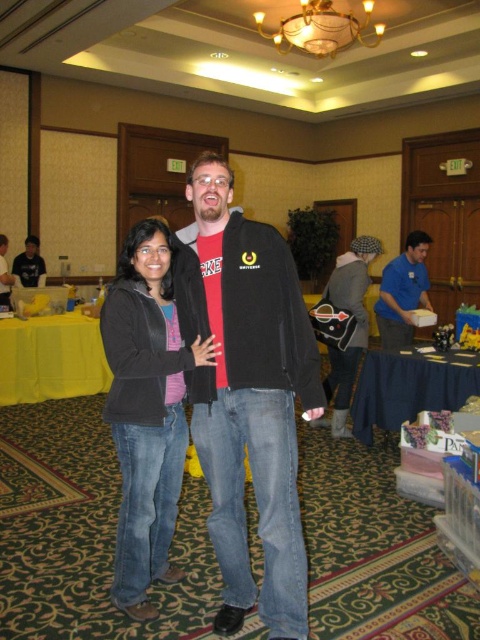
Does black soft jacket at center have a lesser width compared to blue shirt at center?

Indeed, black soft jacket at center has a lesser width compared to blue shirt at center.

Does black soft jacket at center appear on the right side of blue shirt at center?

Incorrect, black soft jacket at center is not on the right side of blue shirt at center.

Is point (136, 406) positioned behind point (385, 316)?

That is False.

Locate an element on the screen. black soft jacket at center is located at coordinates (146, 410).

Does black soft jacket at center have a smaller size compared to matte black jacket at left?

Actually, black soft jacket at center might be larger than matte black jacket at left.

Measure the distance between black soft jacket at center and matte black jacket at left.

black soft jacket at center is 18.88 feet away from matte black jacket at left.

The height and width of the screenshot is (640, 480). In order to click on black soft jacket at center in this screenshot , I will do `click(146, 410)`.

Who is more forward, [12,387] or [400,294]?

Point [400,294] is more forward.

Who is shorter, yellow fabric table at left or blue shirt at center?

Standing shorter between the two is yellow fabric table at left.

Which is behind, point (97, 340) or point (384, 284)?

Positioned behind is point (97, 340).

The image size is (480, 640). Identify the location of yellow fabric table at left. (50, 358).